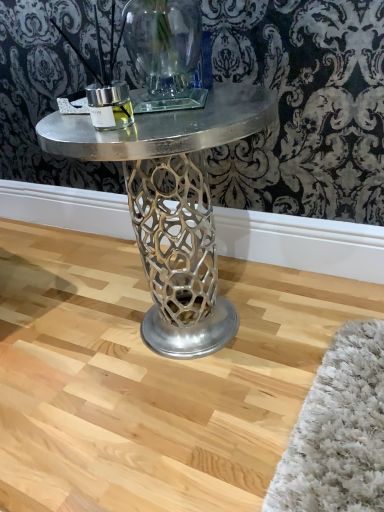
Locate an element on the screen. The height and width of the screenshot is (512, 384). white fluffy rug at lower right is located at coordinates (338, 431).

Describe the element at coordinates (338, 431) in the screenshot. I see `white fluffy rug at lower right` at that location.

This screenshot has height=512, width=384. In order to click on white fluffy rug at lower right in this screenshot , I will do `click(338, 431)`.